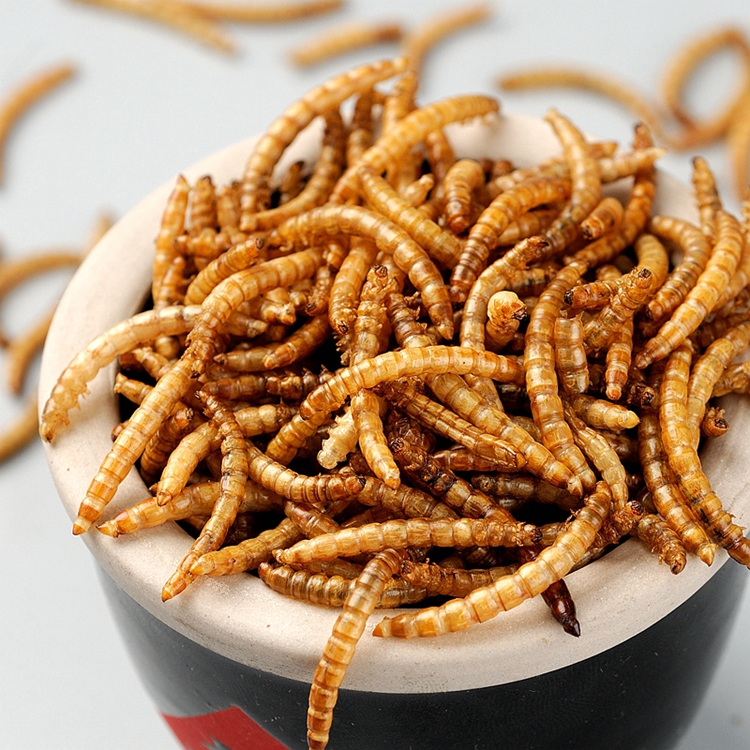
Find the location of a particular element. white rim of bowl is located at coordinates (254, 637).